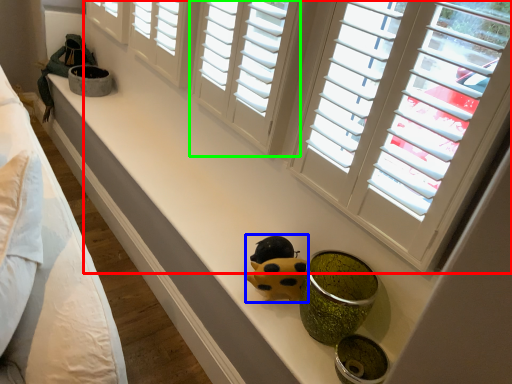
Question: Which object is positioned closest to window (highlighted by a red box)? Select from figurine (highlighted by a blue box) and window (highlighted by a green box).

Choices:
 (A) figurine
 (B) window

Answer: (B)